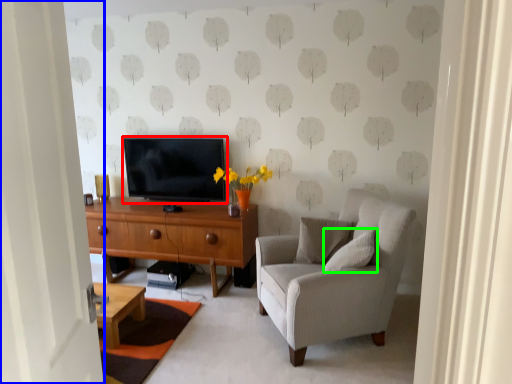
Question: Which is nearer to the television (highlighted by a red box)? door (highlighted by a blue box) or pillow (highlighted by a green box).

Choices:
 (A) door
 (B) pillow

Answer: (B)